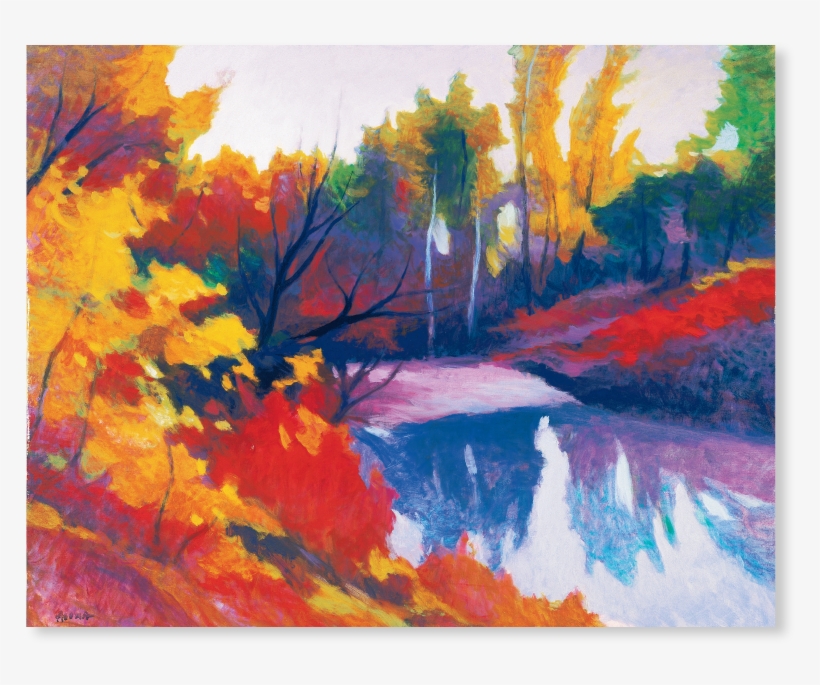
The image size is (820, 685). I want to click on painting of sky, so click(189, 64), click(261, 118), click(295, 77), click(390, 66), click(503, 155), click(659, 142), click(648, 108), click(694, 61), click(729, 138), click(586, 62).